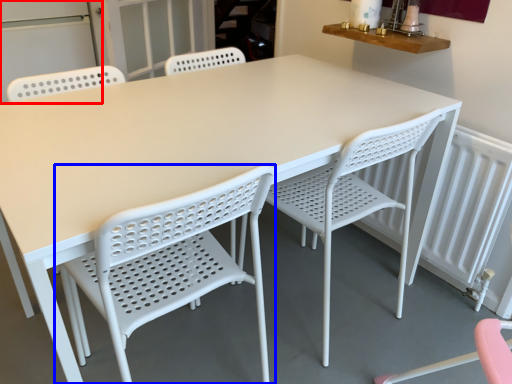
Question: Which object is further to the camera taking this photo, screen door (highlighted by a red box) or chair (highlighted by a blue box)?

Choices:
 (A) screen door
 (B) chair

Answer: (A)